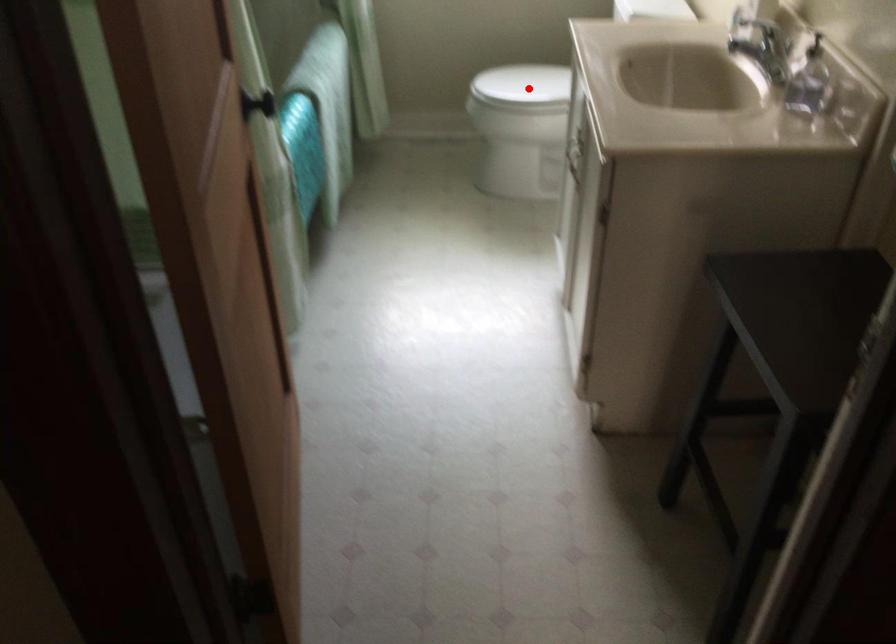
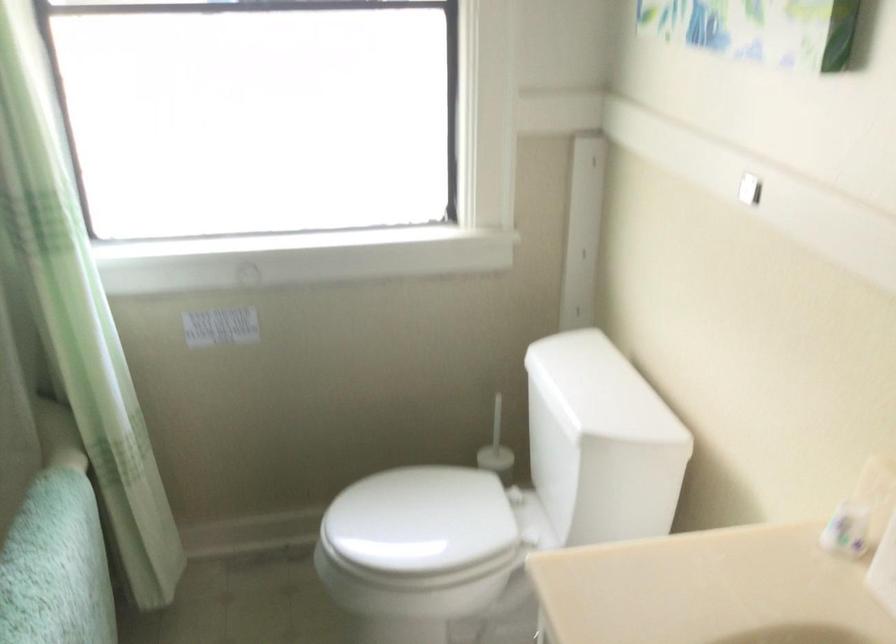
Question: I am providing you with two images of the same scene from different viewpoints. Image1 has a red point marked. In image2, the corresponding 3D location appears at what relative position? Reply with the corresponding letter.

Choices:
 (A) Closer
 (B) Farther

Answer: (A)